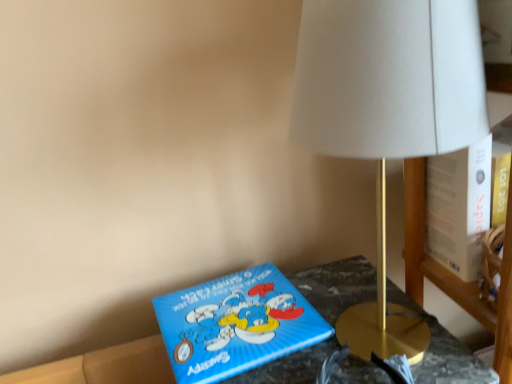
Find the location of a particular element. free point above blue cardboard box at lower left (from a real-world perspective) is located at coordinates (258, 316).